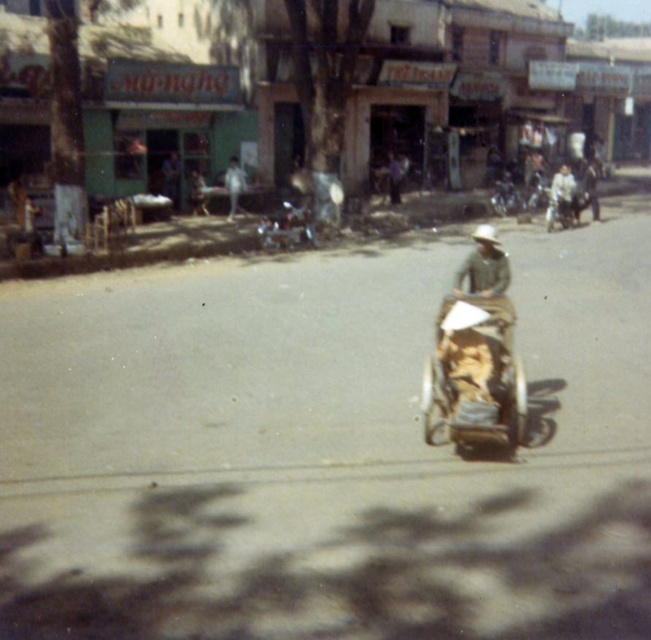
Question: Among these points, which one is nearest to the camera?

Choices:
 (A) (281, 241)
 (B) (229, 189)
 (C) (516, 448)

Answer: (C)

Question: Is light brown leather jacket at center positioned in front of brown leather hat at center?

Choices:
 (A) no
 (B) yes

Answer: (B)

Question: Which point appears farthest from the camera in this image?

Choices:
 (A) (398, 188)
 (B) (454, 307)
 (C) (275, 214)

Answer: (A)

Question: Considering the relative positions of wooden textured baby carriage at center and metallic silver motorcycle at center in the image provided, where is wooden textured baby carriage at center located with respect to metallic silver motorcycle at center?

Choices:
 (A) above
 (B) below

Answer: (B)

Question: In this image, where is wooden textured baby carriage at center located relative to light brown leather jacket at center?

Choices:
 (A) above
 (B) below

Answer: (B)

Question: Which object appears farthest from the camera in this image?

Choices:
 (A) wooden textured baby carriage at center
 (B) light brown leather jacket at center

Answer: (B)